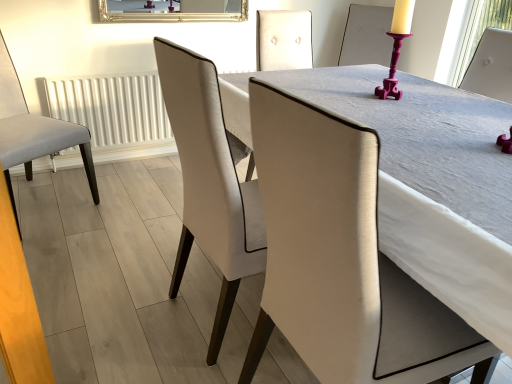
What do you see at coordinates (173, 11) in the screenshot? The height and width of the screenshot is (384, 512). I see `gold-framed mirror at upper center` at bounding box center [173, 11].

The height and width of the screenshot is (384, 512). Describe the element at coordinates (379, 223) in the screenshot. I see `matte white chair at center, which ranks as the 1th chair in right-to-left order` at that location.

The image size is (512, 384). Describe the element at coordinates (34, 131) in the screenshot. I see `light gray fabric chair at left, the first chair viewed from the left` at that location.

The height and width of the screenshot is (384, 512). What are the coordinates of `white textured radiator at left` in the screenshot? It's located at (114, 112).

Considering the relative positions of gold-framed mirror at upper center and light gray fabric chair at left, the second chair viewed from the right, in the image provided, is gold-framed mirror at upper center to the right of light gray fabric chair at left, the second chair viewed from the right, from the viewer's perspective?

Correct, you'll find gold-framed mirror at upper center to the right of light gray fabric chair at left, the second chair viewed from the right.

From a real-world perspective, which object rests below the other?

light gray fabric chair at left, the second chair viewed from the right, from a real-world perspective.

Is light gray fabric chair at left, the second chair viewed from the right, at the back of gold-framed mirror at upper center?

That's not correct — gold-framed mirror at upper center is not looking away from light gray fabric chair at left, the second chair viewed from the right.

Based on their sizes in the image, would you say gold-framed mirror at upper center is bigger or smaller than light gray fabric chair at left, the second chair viewed from the right?

Clearly, gold-framed mirror at upper center is smaller in size than light gray fabric chair at left, the second chair viewed from the right.

Could you tell me if white textured radiator at left is facing matte white chair at center, which is the 2th chair in left-to-right order?

Yes, white textured radiator at left is turned towards matte white chair at center, which is the 2th chair in left-to-right order.

Consider the image. Would you say white textured radiator at left is inside or outside matte white chair at center, which ranks as the 1th chair in right-to-left order?

white textured radiator at left lies outside matte white chair at center, which ranks as the 1th chair in right-to-left order.

Considering the relative positions of white textured radiator at left and matte white chair at center, which ranks as the 1th chair in right-to-left order, in the image provided, is white textured radiator at left to the right of matte white chair at center, which ranks as the 1th chair in right-to-left order, from the viewer's perspective?

Incorrect, white textured radiator at left is not on the right side of matte white chair at center, which ranks as the 1th chair in right-to-left order.

From the picture: Based on their sizes in the image, would you say white textured radiator at left is bigger or smaller than matte white chair at center, which ranks as the 1th chair in right-to-left order?

Considering their sizes, white textured radiator at left takes up less space than matte white chair at center, which ranks as the 1th chair in right-to-left order.

Is point (54, 146) closer to viewer compared to point (209, 4)?

Yes, point (54, 146) is in front of point (209, 4).

Is light gray fabric chair at left, the second chair viewed from the right, aimed at gold-framed mirror at upper center?

No, light gray fabric chair at left, the second chair viewed from the right, is not turned towards gold-framed mirror at upper center.

Considering the relative sizes of light gray fabric chair at left, the first chair viewed from the left, and gold-framed mirror at upper center in the image provided, is light gray fabric chair at left, the first chair viewed from the left, shorter than gold-framed mirror at upper center?

In fact, light gray fabric chair at left, the first chair viewed from the left, may be taller than gold-framed mirror at upper center.

From the image's perspective, starting from the gold-framed mirror at upper center, which chair is the 1st one below? Please provide its 2D coordinates.

[(34, 131)]

How distant is matte white chair at center, which ranks as the 1th chair in right-to-left order, from gold-framed mirror at upper center?

matte white chair at center, which ranks as the 1th chair in right-to-left order, and gold-framed mirror at upper center are 6.02 feet apart.

Which object is positioned more to the right, matte white chair at center, which ranks as the 1th chair in right-to-left order, or gold-framed mirror at upper center?

matte white chair at center, which ranks as the 1th chair in right-to-left order.

Is matte white chair at center, which ranks as the 1th chair in right-to-left order, taller or shorter than gold-framed mirror at upper center?

In the image, matte white chair at center, which ranks as the 1th chair in right-to-left order, appears to be taller than gold-framed mirror at upper center.

Is matte white chair at center, which is the 2th chair in left-to-right order, positioned in front of gold-framed mirror at upper center?

Yes.

Which of these two, matte white chair at center, which ranks as the 1th chair in right-to-left order, or light gray fabric chair at left, the second chair viewed from the right, is smaller?

light gray fabric chair at left, the second chair viewed from the right.

How many degrees apart are the facing directions of matte white chair at center, which is the 2th chair in left-to-right order, and light gray fabric chair at left, the second chair viewed from the right?

The facing directions of matte white chair at center, which is the 2th chair in left-to-right order, and light gray fabric chair at left, the second chair viewed from the right, are 121 degrees apart.

Looking at their sizes, would you say matte white chair at center, which ranks as the 1th chair in right-to-left order, is wider or thinner than light gray fabric chair at left, the first chair viewed from the left?

Clearly, matte white chair at center, which ranks as the 1th chair in right-to-left order, has more width compared to light gray fabric chair at left, the first chair viewed from the left.

Is point (424, 175) positioned in front of point (74, 112)?

Yes, it is.

Does matte white chair at center, which ranks as the 1th chair in right-to-left order, have a smaller size compared to white textured radiator at left?

Actually, matte white chair at center, which ranks as the 1th chair in right-to-left order, might be larger than white textured radiator at left.

Visually, is matte white chair at center, which is the 2th chair in left-to-right order, positioned to the left or to the right of white textured radiator at left?

matte white chair at center, which is the 2th chair in left-to-right order, is positioned on white textured radiator at left's right side.

Can you confirm if matte white chair at center, which ranks as the 1th chair in right-to-left order, is thinner than white textured radiator at left?

In fact, matte white chair at center, which ranks as the 1th chair in right-to-left order, might be wider than white textured radiator at left.

Is light gray fabric chair at left, the first chair viewed from the left, smaller than white textured radiator at left?

Incorrect, light gray fabric chair at left, the first chair viewed from the left, is not smaller in size than white textured radiator at left.

Can you confirm if light gray fabric chair at left, the first chair viewed from the left, is taller than white textured radiator at left?

Yes, light gray fabric chair at left, the first chair viewed from the left, is taller than white textured radiator at left.

Considering the sizes of objects light gray fabric chair at left, the second chair viewed from the right, and white textured radiator at left in the image provided, who is wider, light gray fabric chair at left, the second chair viewed from the right, or white textured radiator at left?

With larger width is light gray fabric chair at left, the second chair viewed from the right.

Locate an element on the screen. This screenshot has width=512, height=384. mirror that is on the right side of light gray fabric chair at left, the second chair viewed from the right is located at coordinates (173, 11).

Find the location of a particular element. This screenshot has height=384, width=512. radiator on the left of matte white chair at center, which ranks as the 1th chair in right-to-left order is located at coordinates [x=114, y=112].

Considering their positions, is white textured radiator at left positioned closer to matte white chair at center, which ranks as the 1th chair in right-to-left order, than light gray fabric chair at left, the first chair viewed from the left?

Among the two, light gray fabric chair at left, the first chair viewed from the left, is located nearer to matte white chair at center, which ranks as the 1th chair in right-to-left order.

When comparing their distances from light gray fabric chair at left, the first chair viewed from the left, does gold-framed mirror at upper center or white textured radiator at left seem further?

The object further to light gray fabric chair at left, the first chair viewed from the left, is gold-framed mirror at upper center.

From the picture: Considering their positions, is matte white chair at center, which ranks as the 1th chair in right-to-left order, positioned further to white textured radiator at left than gold-framed mirror at upper center?

matte white chair at center, which ranks as the 1th chair in right-to-left order, is further to white textured radiator at left.

Considering their positions, is light gray fabric chair at left, the second chair viewed from the right, positioned further to gold-framed mirror at upper center than white textured radiator at left?

Among the two, light gray fabric chair at left, the second chair viewed from the right, is located further to gold-framed mirror at upper center.

Looking at this image, estimate the real-world distances between objects in this image. Which object is closer to matte white chair at center, which ranks as the 1th chair in right-to-left order, white textured radiator at left or gold-framed mirror at upper center?

white textured radiator at left lies closer to matte white chair at center, which ranks as the 1th chair in right-to-left order, than the other object.

Considering their positions, is gold-framed mirror at upper center positioned closer to white textured radiator at left than matte white chair at center, which ranks as the 1th chair in right-to-left order?

The object closer to white textured radiator at left is gold-framed mirror at upper center.

Estimate the real-world distances between objects in this image. Which object is further from gold-framed mirror at upper center, white textured radiator at left or matte white chair at center, which ranks as the 1th chair in right-to-left order?

The object further to gold-framed mirror at upper center is matte white chair at center, which ranks as the 1th chair in right-to-left order.

Which object lies nearer to the anchor point gold-framed mirror at upper center, white textured radiator at left or light gray fabric chair at left, the second chair viewed from the right?

Based on the image, white textured radiator at left appears to be nearer to gold-framed mirror at upper center.

Find the location of `mirror between matte white chair at center, which ranks as the 1th chair in right-to-left order, and white textured radiator at left, along the z-axis`. mirror between matte white chair at center, which ranks as the 1th chair in right-to-left order, and white textured radiator at left, along the z-axis is located at coordinates (173, 11).

Where is `radiator located between light gray fabric chair at left, the second chair viewed from the right, and matte white chair at center, which ranks as the 1th chair in right-to-left order, in the left-right direction`? This screenshot has width=512, height=384. radiator located between light gray fabric chair at left, the second chair viewed from the right, and matte white chair at center, which ranks as the 1th chair in right-to-left order, in the left-right direction is located at coordinates (114, 112).

You are a GUI agent. You are given a task and a screenshot of the screen. Output one action in this format:
    pyautogui.click(x=<x>, y=<y>)
    Task: Click on the mirror between light gray fabric chair at left, the first chair viewed from the left, and matte white chair at center, which ranks as the 1th chair in right-to-left order, in the horizontal direction
    
    Given the screenshot: What is the action you would take?
    pyautogui.click(x=173, y=11)

This screenshot has height=384, width=512. In order to click on mirror between light gray fabric chair at left, the second chair viewed from the right, and white textured radiator at left from front to back in this screenshot , I will do `click(173, 11)`.